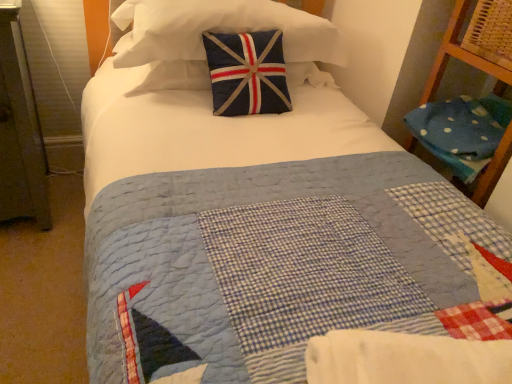
Question: Considering the relative sizes of navy blue fabric pillow at upper center, the second pillow when ordered from right to left, and blue polka dot fabric at right, positioned as the 2th pillow in top-to-bottom order, in the image provided, is navy blue fabric pillow at upper center, the second pillow when ordered from right to left, smaller than blue polka dot fabric at right, positioned as the 2th pillow in top-to-bottom order,?

Choices:
 (A) yes
 (B) no

Answer: (B)

Question: Is navy blue fabric pillow at upper center, acting as the first pillow starting from the left, bigger than blue polka dot fabric at right, which is the 1th pillow from right to left?

Choices:
 (A) no
 (B) yes

Answer: (B)

Question: Does navy blue fabric pillow at upper center, the second pillow when ordered from right to left, appear on the right side of blue polka dot fabric at right, positioned as the 2th pillow in top-to-bottom order?

Choices:
 (A) no
 (B) yes

Answer: (A)

Question: Does navy blue fabric pillow at upper center, the second pillow when ordered from right to left, have a greater width compared to blue polka dot fabric at right, positioned as the 2th pillow in top-to-bottom order?

Choices:
 (A) no
 (B) yes

Answer: (A)

Question: Is navy blue fabric pillow at upper center, which is the 1th pillow from top to bottom, thinner than blue polka dot fabric at right, which is the 1th pillow from right to left?

Choices:
 (A) no
 (B) yes

Answer: (B)

Question: Is navy blue fabric pillow at upper center, the second pillow when ordered from right to left, far from blue polka dot fabric at right, positioned as the 2th pillow in top-to-bottom order?

Choices:
 (A) yes
 (B) no

Answer: (B)

Question: Can you confirm if blue polka dot fabric at right, positioned as the 2th pillow in top-to-bottom order, is smaller than navy blue fabric pillow at upper center, which is the 1th pillow from top to bottom?

Choices:
 (A) no
 (B) yes

Answer: (B)

Question: Does blue polka dot fabric at right, which is the 1th pillow from right to left, appear on the left side of navy blue fabric pillow at upper center, which is the 1th pillow from top to bottom?

Choices:
 (A) no
 (B) yes

Answer: (A)

Question: Considering the relative sizes of blue polka dot fabric at right, which is the 1th pillow from right to left, and navy blue fabric pillow at upper center, the second pillow when ordered from right to left, in the image provided, is blue polka dot fabric at right, which is the 1th pillow from right to left, bigger than navy blue fabric pillow at upper center, the second pillow when ordered from right to left,?

Choices:
 (A) no
 (B) yes

Answer: (A)

Question: Is blue polka dot fabric at right, which is the 1th pillow from right to left, thinner than navy blue fabric pillow at upper center, the second pillow when ordered from right to left?

Choices:
 (A) no
 (B) yes

Answer: (A)

Question: From the image's perspective, is blue polka dot fabric at right, positioned as the 2th pillow in top-to-bottom order, on top of navy blue fabric pillow at upper center, acting as the first pillow starting from the left?

Choices:
 (A) yes
 (B) no

Answer: (B)

Question: From the image's perspective, is blue polka dot fabric at right, the 1th pillow from the bottom, beneath navy blue fabric pillow at upper center, the 2th pillow in the bottom-to-top sequence?

Choices:
 (A) yes
 (B) no

Answer: (A)

Question: Does white cotton blanket at center come in front of navy blue fabric pillow at upper center, the second pillow when ordered from right to left?

Choices:
 (A) no
 (B) yes

Answer: (B)